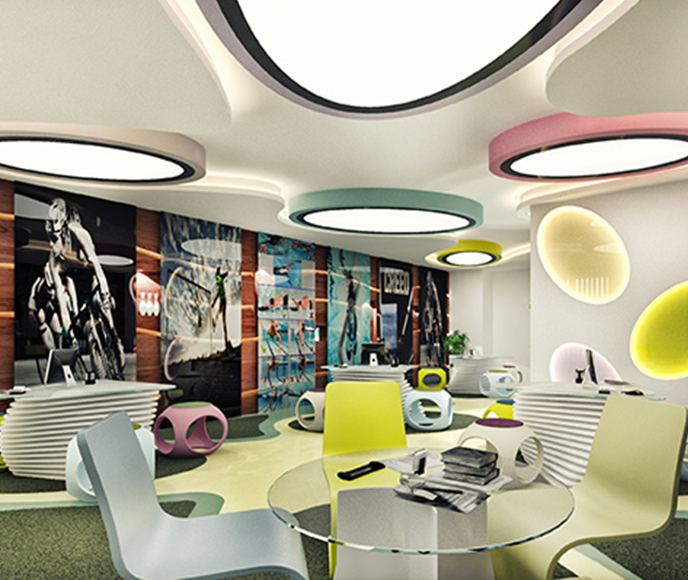
Where is `wall art`? The height and width of the screenshot is (580, 688). wall art is located at coordinates (85, 304), (201, 313), (272, 318), (342, 313), (383, 300), (430, 307).